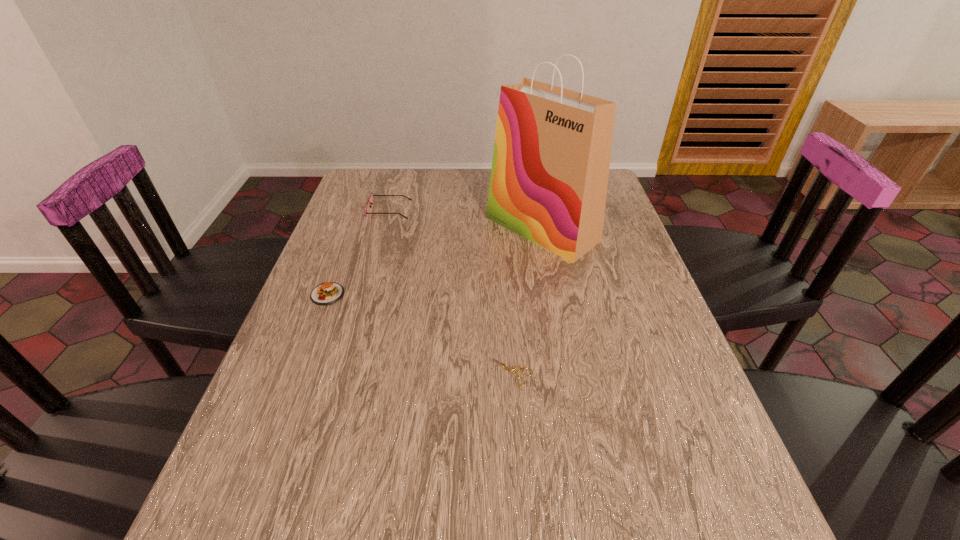
The height and width of the screenshot is (540, 960). I want to click on the tallest object, so pyautogui.click(x=550, y=167).

Identify the location of the second tallest object. (370, 200).

Locate an element on the screen. The width and height of the screenshot is (960, 540). the third tallest object is located at coordinates (327, 293).

The width and height of the screenshot is (960, 540). Identify the location of patty (food). (327, 293).

Locate an element on the screen. the shortest object is located at coordinates (517, 368).

At what (x,y) coordinates should I click in order to perform the action: click on the nearest object. Please return your answer as a coordinate pair (x, y). The width and height of the screenshot is (960, 540). Looking at the image, I should click on (517, 368).

Find the location of `free space located on the front of the tallest object`. free space located on the front of the tallest object is located at coordinates (571, 387).

What are the coordinates of `free space located on the bridge of the third shortest object` in the screenshot? It's located at (523, 210).

You are a GUI agent. You are given a task and a screenshot of the screen. Output one action in this format:
    pyautogui.click(x=<x>, y=<y>)
    Task: Click on the vacant space located on the right of the second nearest object
    This screenshot has height=540, width=960.
    Given the screenshot: What is the action you would take?
    pyautogui.click(x=418, y=294)

The height and width of the screenshot is (540, 960). I want to click on vacant area situated 0.370m on the back of the shears, so click(504, 251).